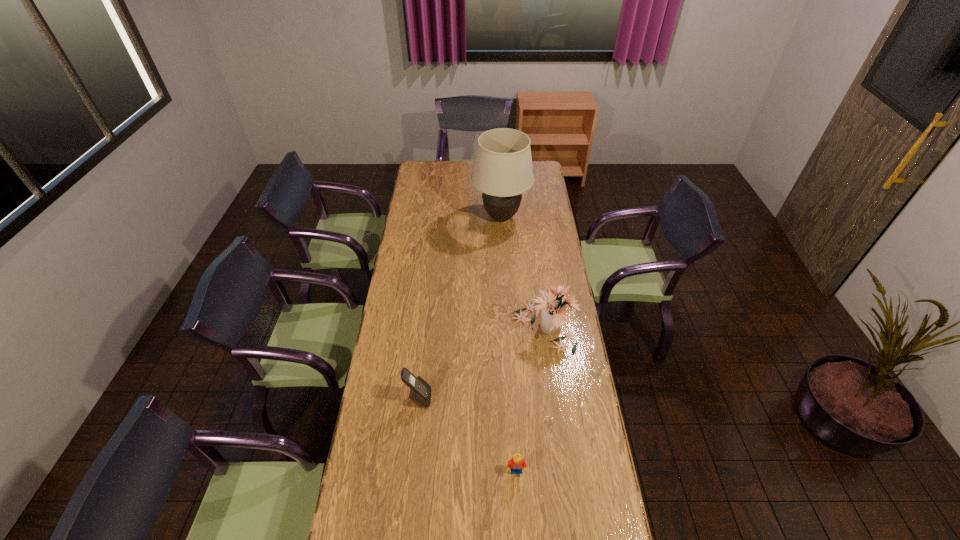
This screenshot has width=960, height=540. Find the location of `vacant area in the image that satisfies the following two spatial constraints: 1. on the front side of the second tallest object; 2. on the front-facing side of the third farthest object`. vacant area in the image that satisfies the following two spatial constraints: 1. on the front side of the second tallest object; 2. on the front-facing side of the third farthest object is located at coordinates (553, 398).